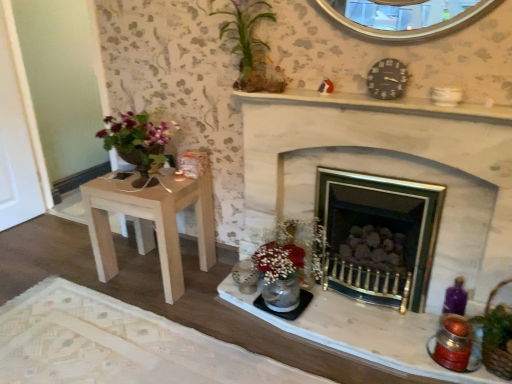
You are a GUI agent. You are given a task and a screenshot of the screen. Output one action in this format:
    pyautogui.click(x=<x>, y=<y>)
    Task: Click on the vacant area that lies between shiny metallic candle holder at lower right, acting as the first candle holder starting from the right, and matte silver candle holder at lower center, which ranks as the first candle holder in left-to-right order
    This screenshot has width=512, height=384.
    Given the screenshot: What is the action you would take?
    pyautogui.click(x=367, y=325)